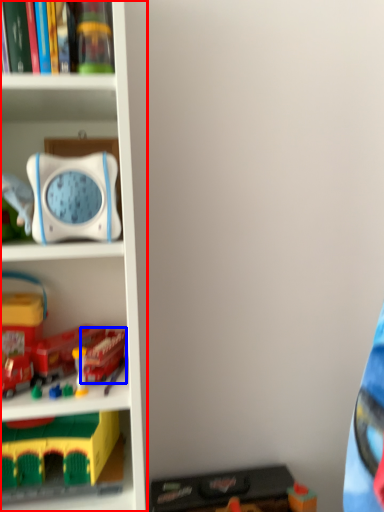
Question: Among these objects, which one is farthest to the camera, bookcase (highlighted by a red box) or toy (highlighted by a blue box)?

Choices:
 (A) bookcase
 (B) toy

Answer: (B)